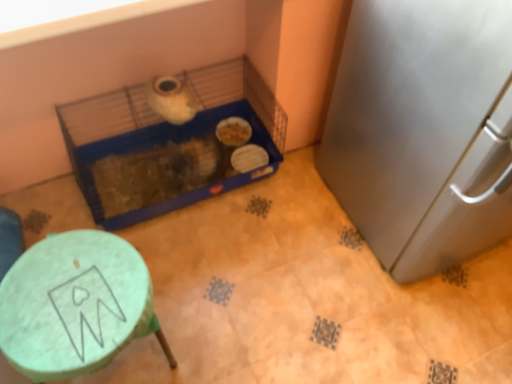
Find the location of `vacant area that lies between satin silver refrigerator at right and green matte stool at lower left`. vacant area that lies between satin silver refrigerator at right and green matte stool at lower left is located at coordinates (270, 277).